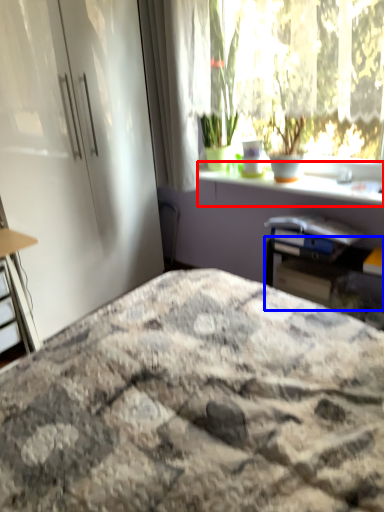
Question: Which point is closer to the camera, window sill (highlighted by a red box) or table (highlighted by a blue box)?

Choices:
 (A) window sill
 (B) table

Answer: (A)